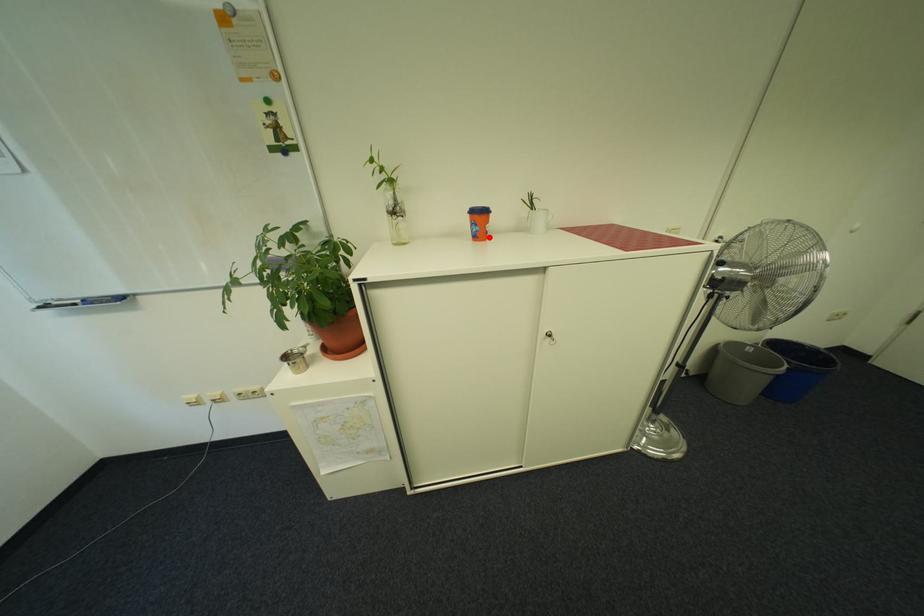
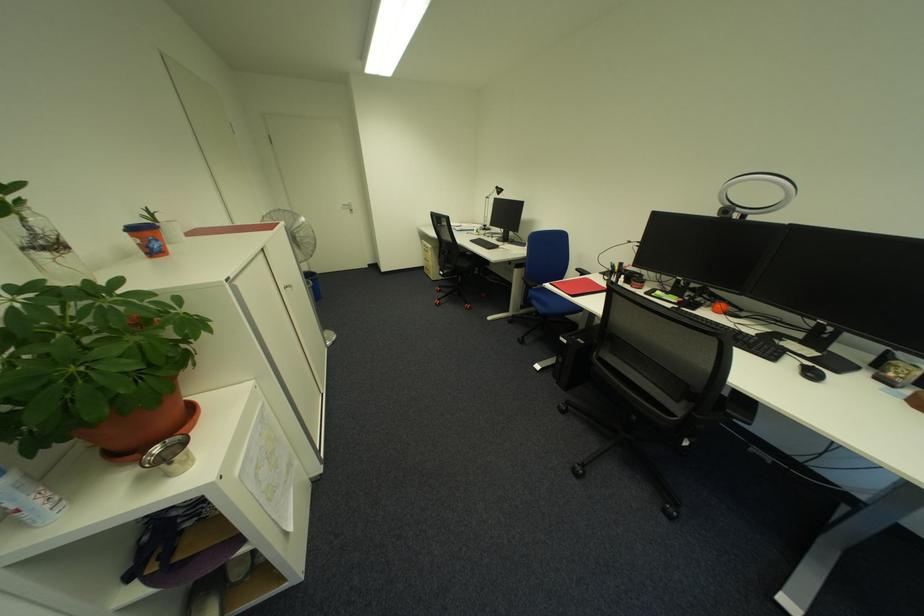
Where in the second image is the point corresponding to the highlighted location from the first image?

(164, 254)